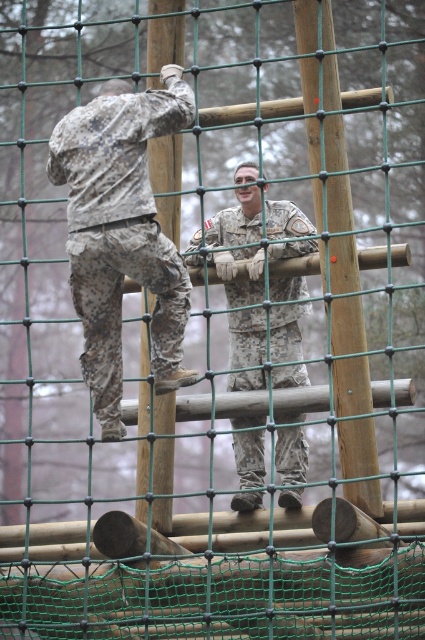
Is point (102, 243) farther from camera compared to point (141, 435)?

No, it is not.

Is point (146, 211) less distant than point (161, 156)?

Yes, point (146, 211) is closer to viewer.

What do you see at coordinates (121, 232) in the screenshot? I see `camouflage fabric soldier at upper left` at bounding box center [121, 232].

At what (x,y) coordinates should I click in order to perform the action: click on camouflage fabric soldier at upper left. Please return your answer as a coordinate pair (x, y). This screenshot has width=425, height=640. Looking at the image, I should click on (121, 232).

Is camouflage fabric soldier at center further to camera compared to camouflage fabric pole at left?

Yes, it is behind camouflage fabric pole at left.

Measure the distance from camouflage fabric soldier at center to camouflage fabric pole at left.

A distance of 19.03 feet exists between camouflage fabric soldier at center and camouflage fabric pole at left.

What do you see at coordinates (237, 220) in the screenshot? Image resolution: width=425 pixels, height=640 pixels. I see `camouflage fabric soldier at center` at bounding box center [237, 220].

This screenshot has width=425, height=640. What are the coordinates of `camouflage fabric soldier at center` in the screenshot? It's located at (237, 220).

Is point (105, 108) positioned after point (303, 435)?

No, it is in front of (303, 435).

Is camouflage fabric soldier at upper left to the left of camouflage fabric soldier at center from the viewer's perspective?

Correct, you'll find camouflage fabric soldier at upper left to the left of camouflage fabric soldier at center.

This screenshot has height=640, width=425. What do you see at coordinates (121, 232) in the screenshot?
I see `camouflage fabric soldier at upper left` at bounding box center [121, 232].

Where is `camouflage fabric soldier at upper left`? The image size is (425, 640). camouflage fabric soldier at upper left is located at coordinates (121, 232).